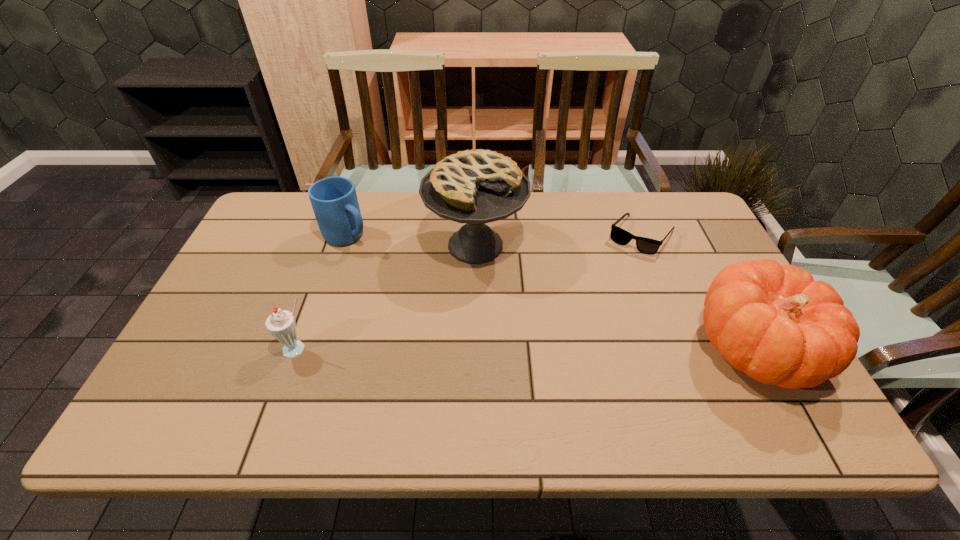
This screenshot has height=540, width=960. What are the coordinates of `free space located 0.230m on the cut side of the tallest object` in the screenshot? It's located at (499, 348).

Find the location of a particular element. vacant area situated on the front-facing side of the sunglasses is located at coordinates (618, 272).

In order to click on vacant space situated on the front-facing side of the sunglasses in this screenshot , I will do `click(582, 335)`.

Locate an element on the screen. This screenshot has height=540, width=960. vacant position located 0.280m on the front-facing side of the sunglasses is located at coordinates (592, 316).

Where is `vacant space located on the side of the mug with the handle`? Image resolution: width=960 pixels, height=540 pixels. vacant space located on the side of the mug with the handle is located at coordinates 407,276.

Identify the location of vacant region located 0.150m on the side of the mug with the handle. (397, 270).

Locate an element on the screen. The width and height of the screenshot is (960, 540). free location located on the side of the mug with the handle is located at coordinates (384, 261).

This screenshot has height=540, width=960. What are the coordinates of `pie that is at the far edge` in the screenshot? It's located at (479, 186).

Find the location of a particular element. The width and height of the screenshot is (960, 540). sunglasses located at the far edge is located at coordinates [x=618, y=235].

Where is `mug located at the far edge`? The image size is (960, 540). mug located at the far edge is located at coordinates (334, 200).